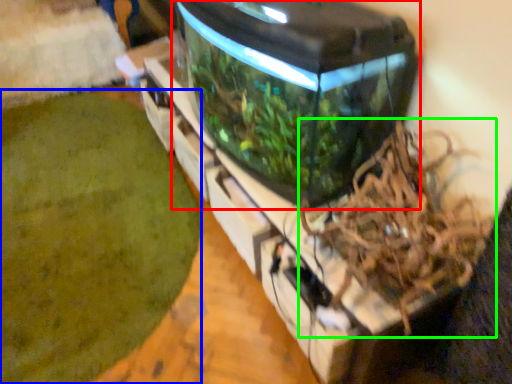
Question: Which is nearer to the water tank (highlighted by a red box)? debris (highlighted by a blue box) or bird nest (highlighted by a green box).

Choices:
 (A) debris
 (B) bird nest

Answer: (B)